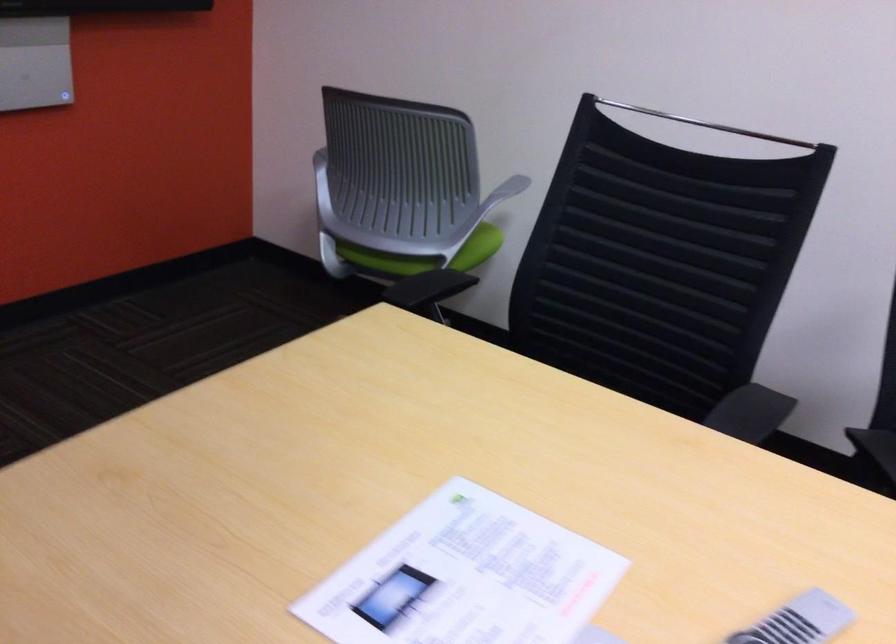
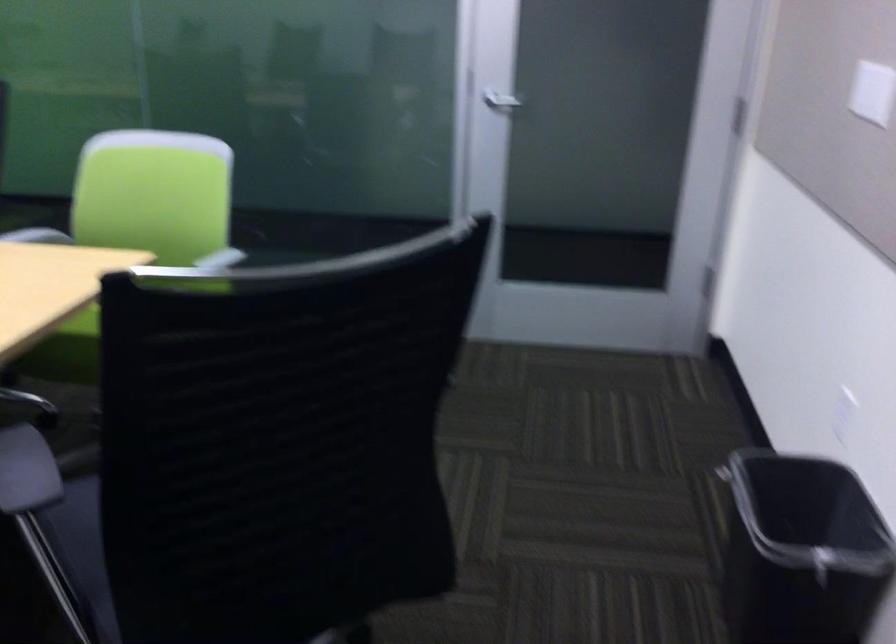
The images are taken continuously from a first-person perspective. In which direction are you moving?

The movement direction of the cameraman is right, backward.